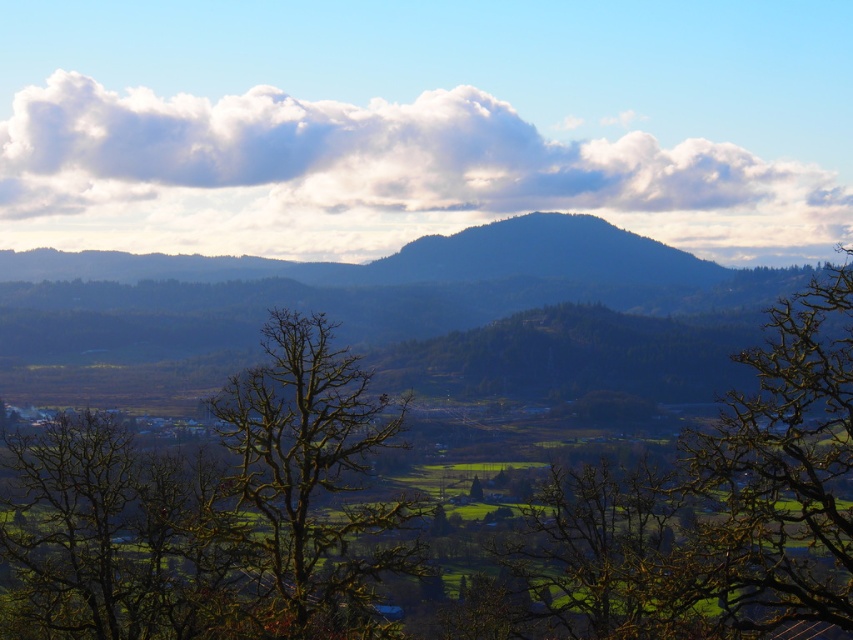
You are an observer standing in the valley looking towards the hills. You notice two trees in the scene. Which one is taller between the green leafy tree at center and the bare branches at center?

The green leafy tree at center is much taller than the bare branches at center according to the description.